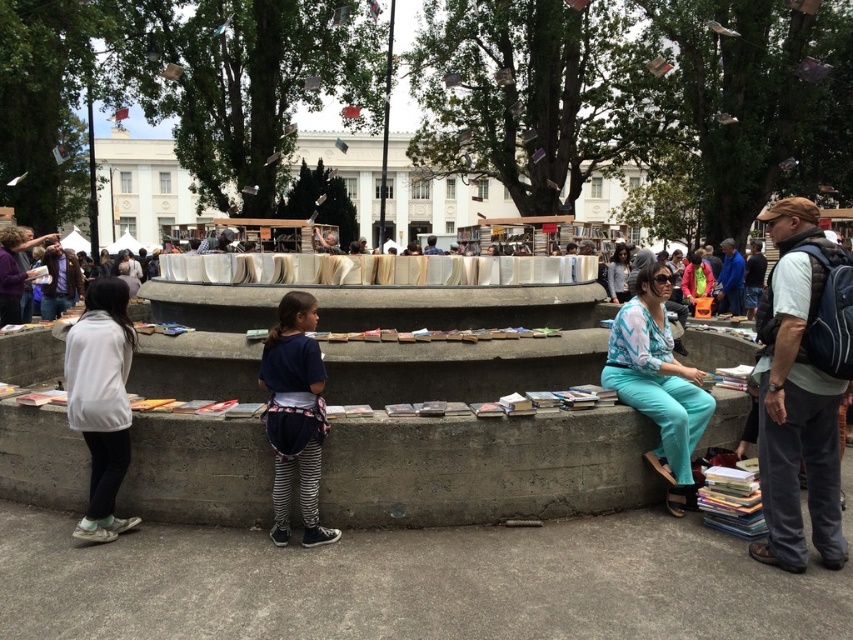
Question: Is dark gray pants at right positioned before dark blue jersey at center?

Choices:
 (A) no
 (B) yes

Answer: (B)

Question: Which point appears closest to the camera in this image?

Choices:
 (A) (769, 326)
 (B) (103, 484)
 (C) (631, 324)

Answer: (A)

Question: Which point is farther to the camera?

Choices:
 (A) white matte jacket at left
 (B) dark gray pants at right
 (C) teal fabric pants at center
 (D) dark blue jersey at center

Answer: (C)

Question: Which of the following is the closest to the observer?

Choices:
 (A) (775, 240)
 (B) (665, 344)

Answer: (A)

Question: Is white matte jacket at left closer to the viewer compared to dark blue jersey at center?

Choices:
 (A) no
 (B) yes

Answer: (B)

Question: Is dark gray pants at right positioned behind white matte jacket at left?

Choices:
 (A) no
 (B) yes

Answer: (A)